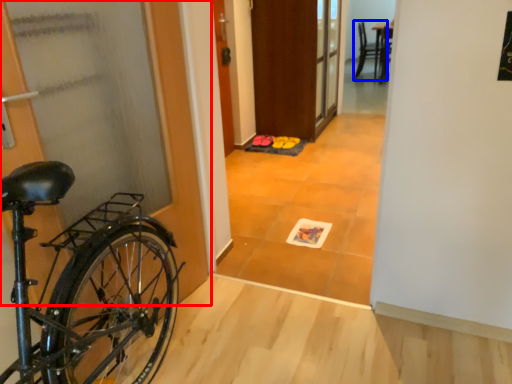
Question: Among these objects, which one is farthest to the camera, door (highlighted by a red box) or chair (highlighted by a blue box)?

Choices:
 (A) door
 (B) chair

Answer: (B)